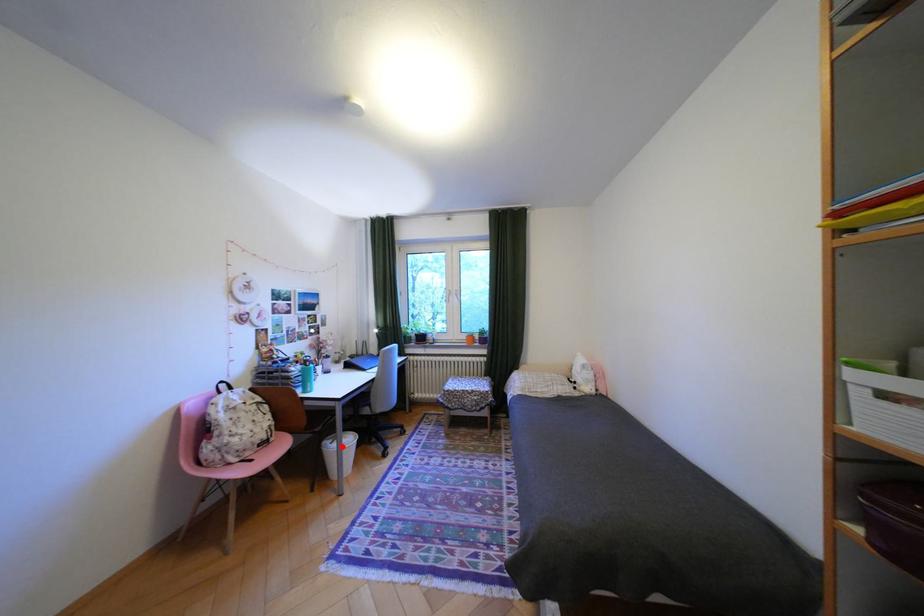
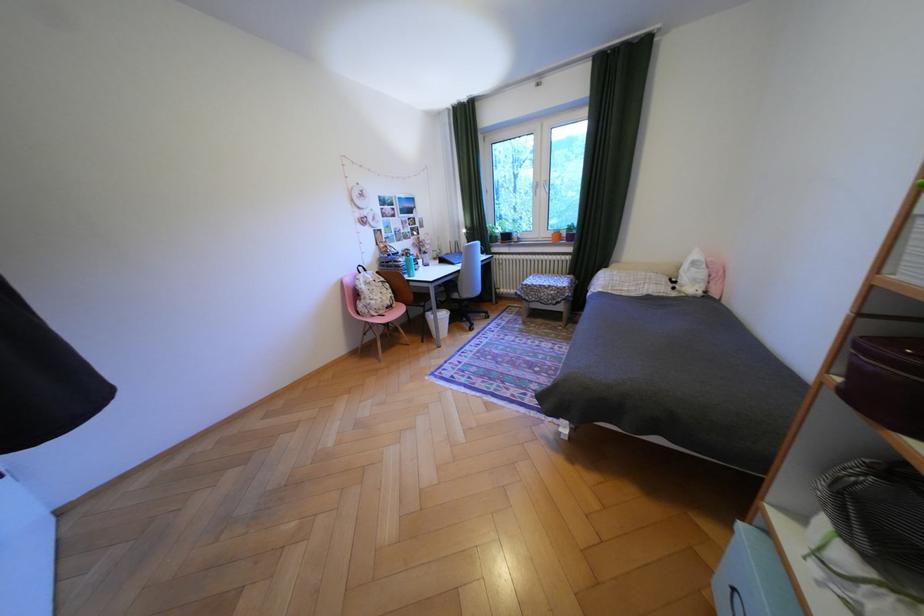
Where in the second image is the point corresponding to the highlighted location from the first image?

(442, 315)